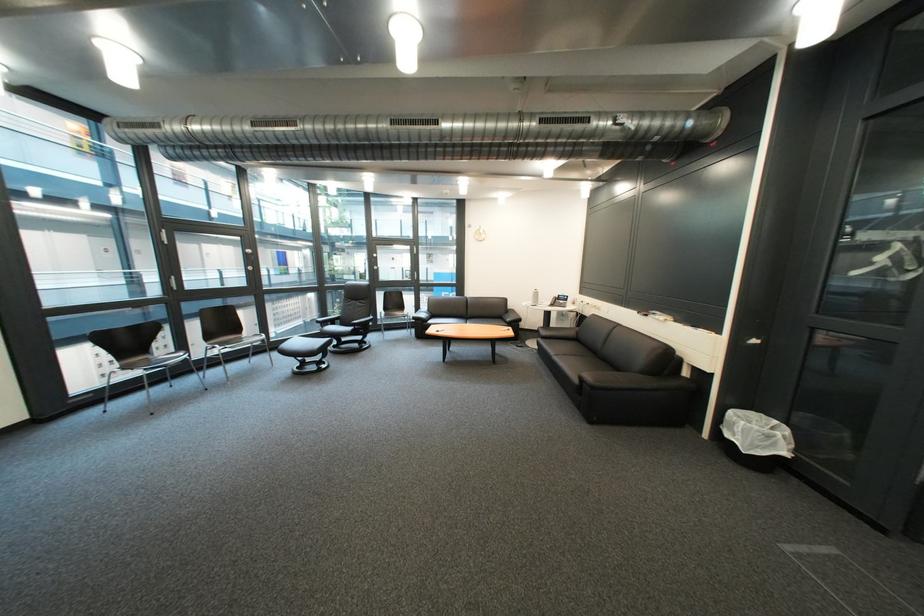
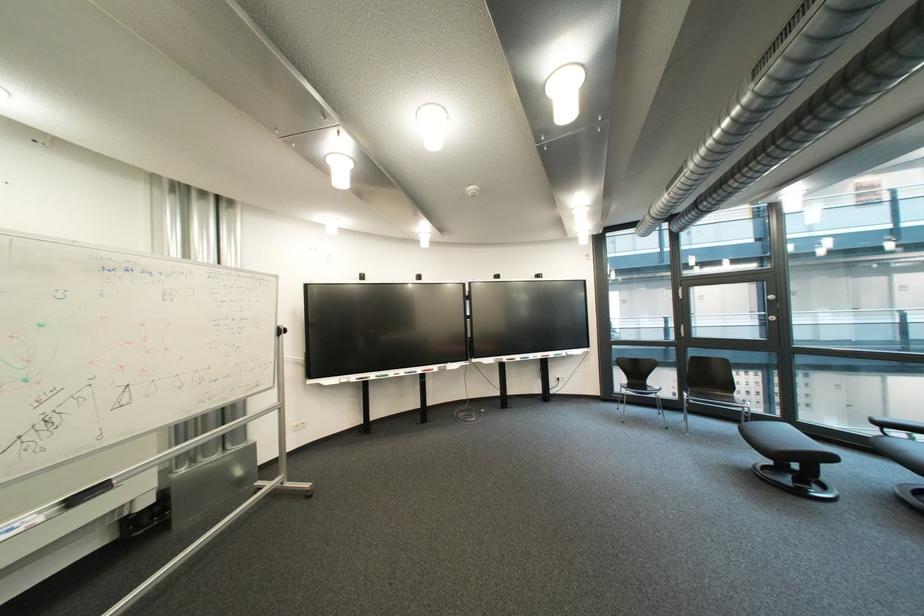
Find the pixel in the second image that matches pixel 131 368 in the first image.

(638, 385)